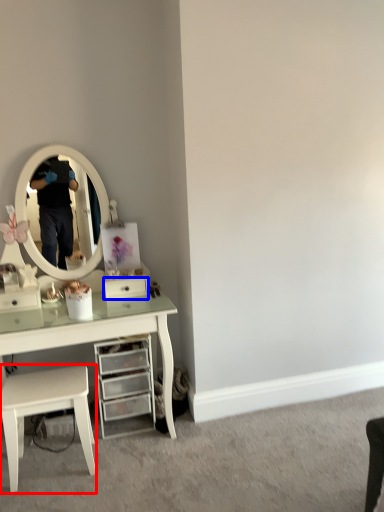
Question: Among these objects, which one is farthest to the camera, stool (highlighted by a red box) or drawer (highlighted by a blue box)?

Choices:
 (A) stool
 (B) drawer

Answer: (B)